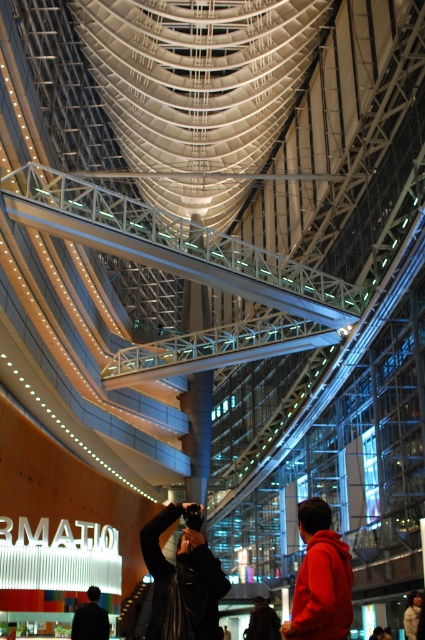
Does dark blue jacket at lower left have a lesser height compared to dark brown leather jacket at lower center?

Indeed, dark blue jacket at lower left has a lesser height compared to dark brown leather jacket at lower center.

In the scene shown: Who is more distant from viewer, (x=99, y=618) or (x=263, y=625)?

The point (x=263, y=625) is more distant.

Locate an element on the screen. The height and width of the screenshot is (640, 425). dark blue jacket at lower left is located at coordinates (90, 618).

How distant is black matte jacket at center from dark blue jacket at lower left?

black matte jacket at center and dark blue jacket at lower left are 17.81 meters apart.

Between black matte jacket at center and dark blue jacket at lower left, which one appears on the left side from the viewer's perspective?

From the viewer's perspective, dark blue jacket at lower left appears more on the left side.

Is point (170, 621) more distant than point (73, 624)?

That is False.

Find the location of a particular element. black matte jacket at center is located at coordinates (183, 580).

Who is taller, red fleece jacket at center or dark brown leather jacket at lower center?

With more height is dark brown leather jacket at lower center.

Where is `red fleece jacket at center`? red fleece jacket at center is located at coordinates (320, 579).